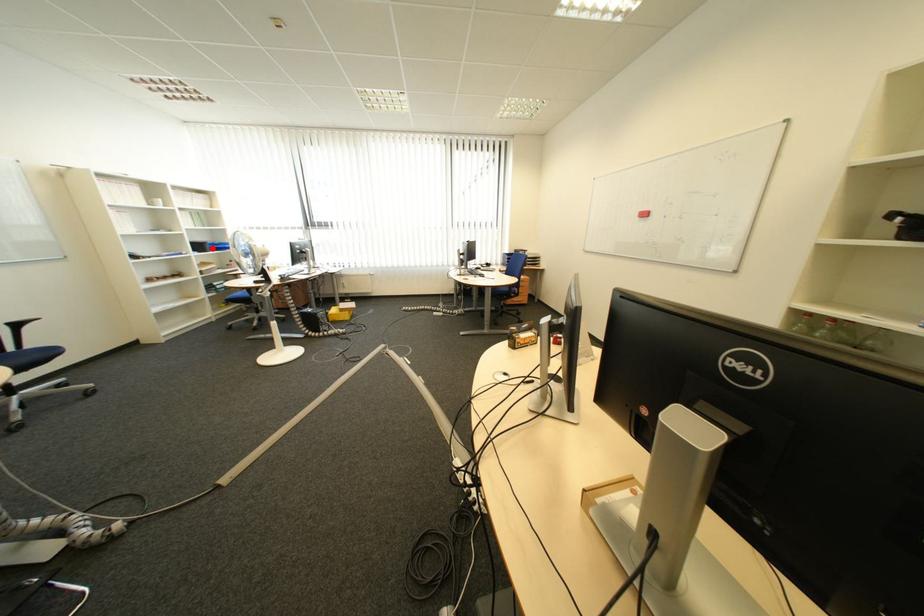
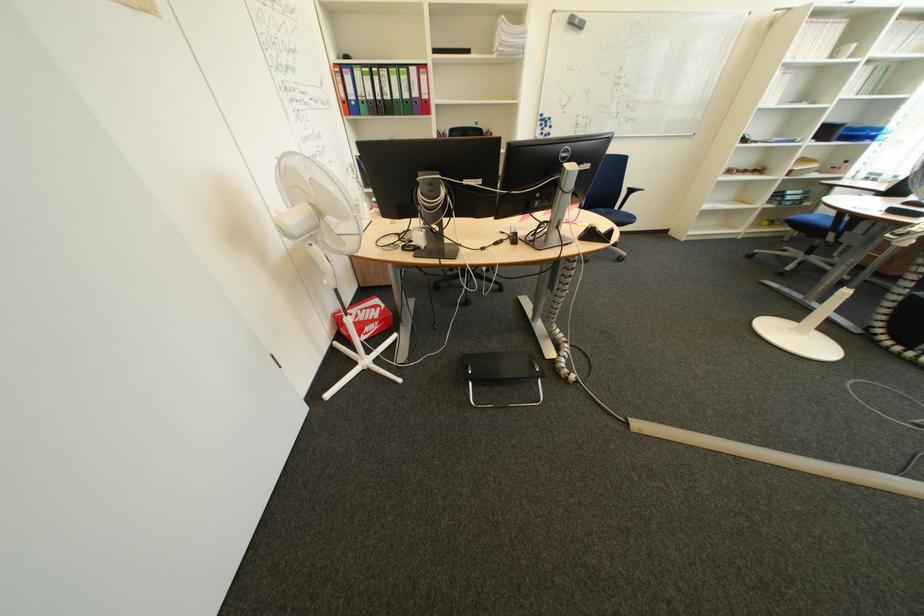
Question: A red point is marked in image1. In image2, is the corresponding 3D point closer to the camera or farther? Reply with the corresponding letter.

Choices:
 (A) The corresponding 3D point is closer.
 (B) The corresponding 3D point is farther.

Answer: (B)